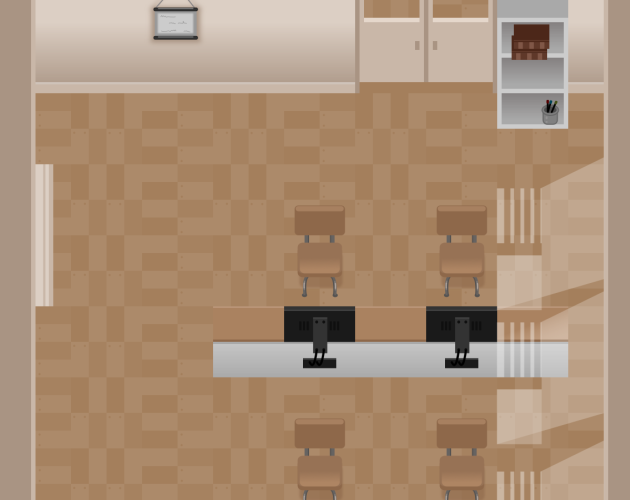
Identify the location of white bookshelf. [534, 72].